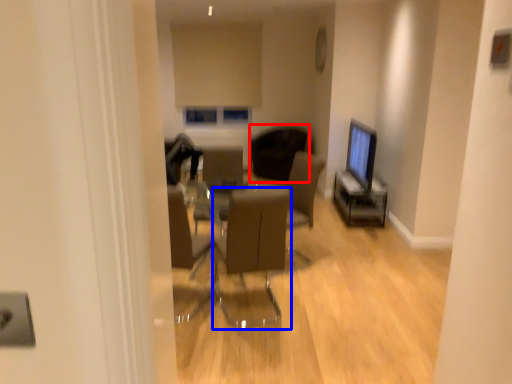
Question: Among these objects, which one is nearest to the camera, chair (highlighted by a red box) or chair (highlighted by a blue box)?

Choices:
 (A) chair
 (B) chair

Answer: (B)